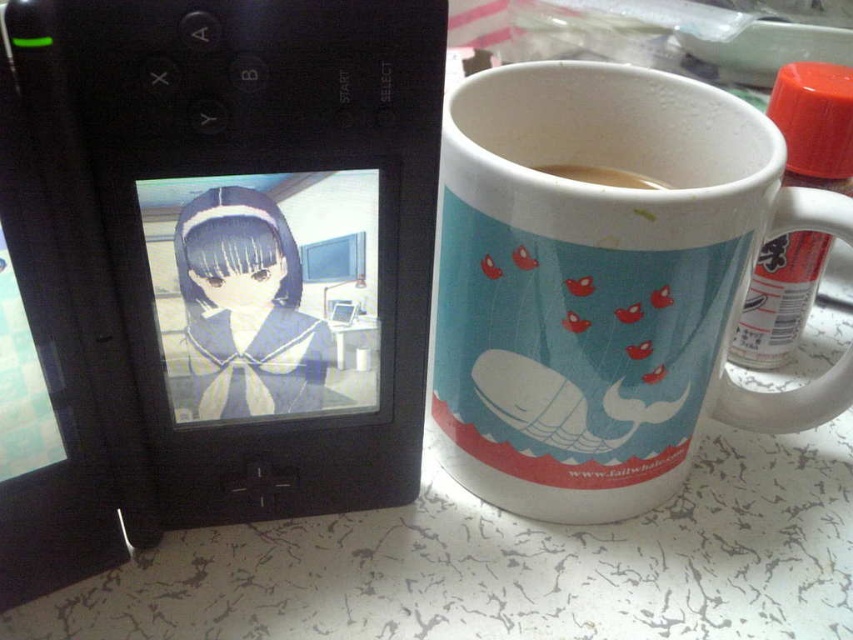
You are setting up a small table for a cozy reading nook. You have a white ceramic mug at right and a brown matte coffee at upper right. Which item should you place closer to the edge of the table to ensure stability?

The white ceramic mug at right should be placed closer to the edge of the table because it is wider than the brown matte coffee at upper right, providing better stability.

In the scene shown: Please provide the coordinates of the white ceramic mug at right in the image. The coordinate system is normalized, with the origin at the bottom left corner of the image. The x and y axes are measured in fractions of the image width and height respectively.

The white ceramic mug at right is located at coordinates approximately at point 0.445 in the x axis and 0.708 in the y axis.

You are holding a stylus and want to draw a line from the center of the gaming console to the point labeled as point (247, 308). Which object will the line pass through?

The line from the center of the gaming console to point (247, 308) will pass through the matte black anime girl at left.